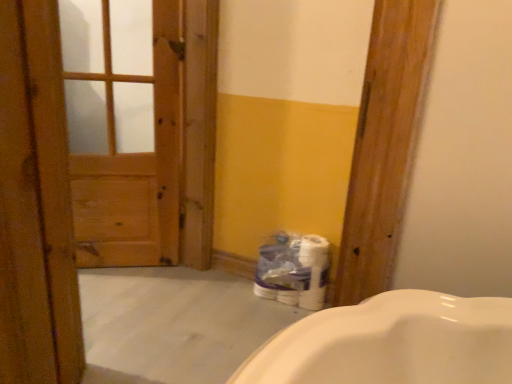
This screenshot has height=384, width=512. Find the location of `vacant area to the left of white glossy toilet paper at lower center`. vacant area to the left of white glossy toilet paper at lower center is located at coordinates (234, 299).